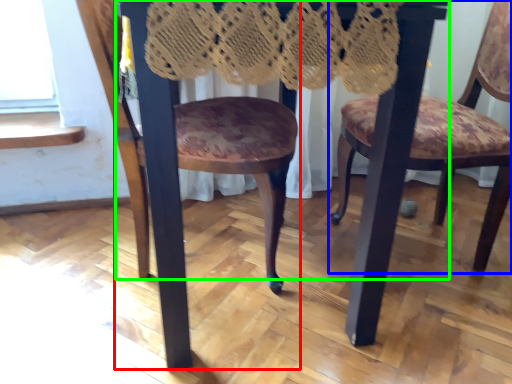
Question: Estimate the real-world distances between objects in this image. Which object is closer to chair (highlighted by a red box), chair (highlighted by a blue box) or table (highlighted by a green box)?

Choices:
 (A) chair
 (B) table

Answer: (B)